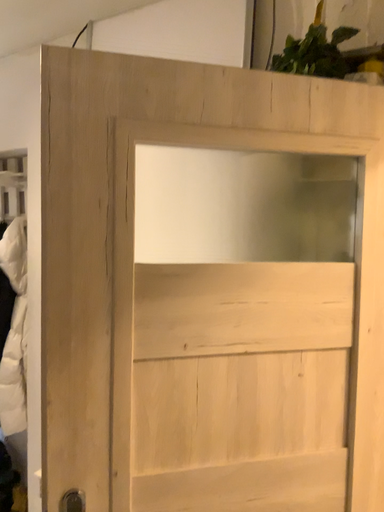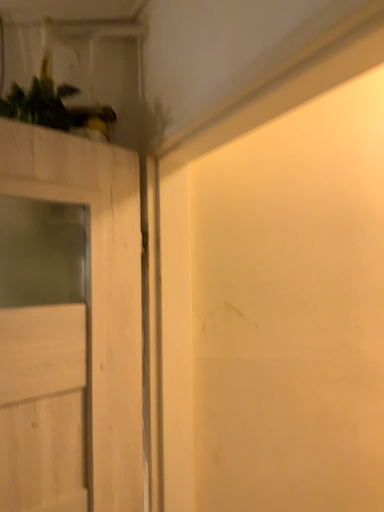
Question: Which way did the camera rotate in the video?

Choices:
 (A) rotated right
 (B) rotated left

Answer: (A)